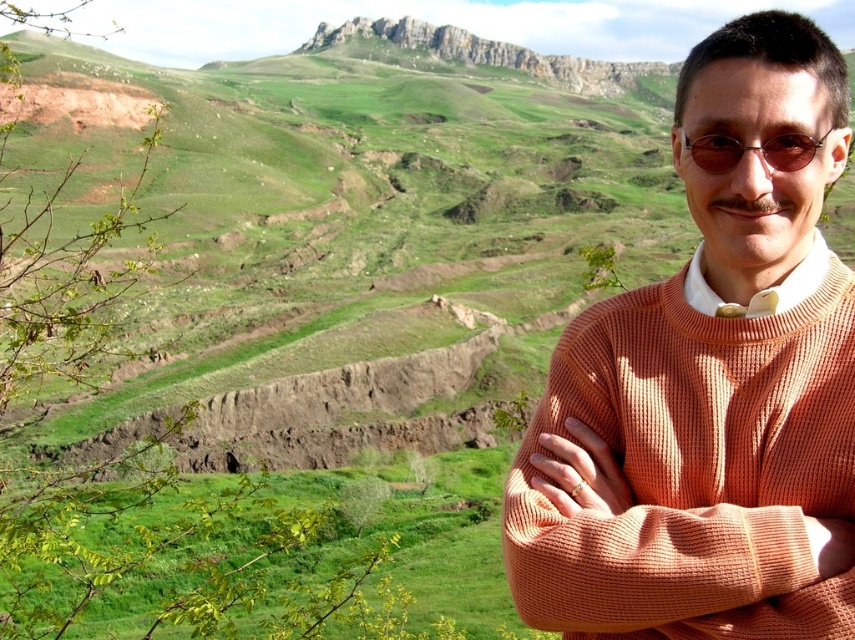
Which of these two, orange waffle-knit sweater at right or sunglasses at center, stands taller?

orange waffle-knit sweater at right

Can you confirm if orange waffle-knit sweater at right is bigger than sunglasses at center?

Yes.

Where is `orange waffle-knit sweater at right`? The height and width of the screenshot is (640, 855). orange waffle-knit sweater at right is located at coordinates [708, 392].

Identify the location of orange waffle-knit sweater at right. The height and width of the screenshot is (640, 855). (708, 392).